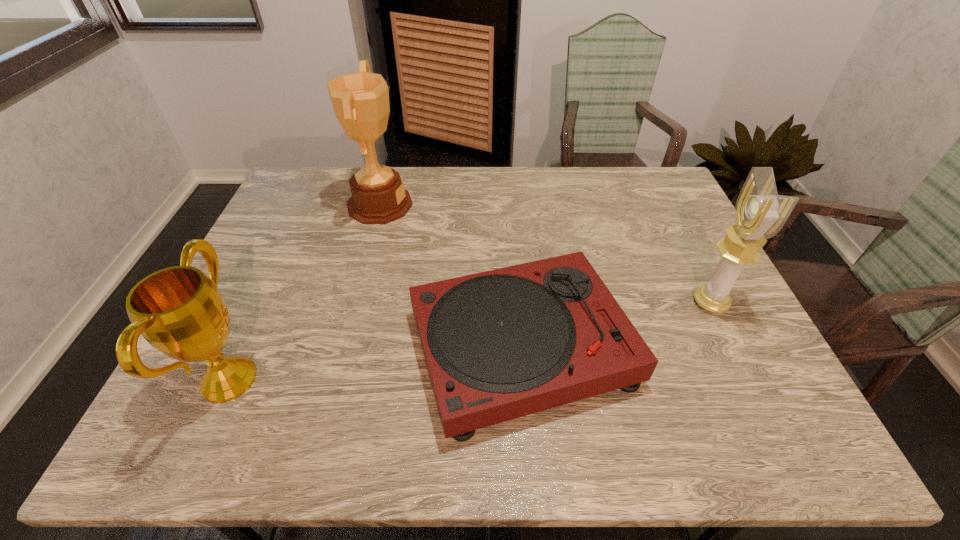
Find the location of `the farthest award`. the farthest award is located at coordinates (360, 100).

Where is `the second award from left to right`? This screenshot has height=540, width=960. the second award from left to right is located at coordinates coord(360,100).

This screenshot has height=540, width=960. What are the coordinates of `the rightmost award` in the screenshot? It's located at (760, 213).

The image size is (960, 540). In order to click on the second nearest award in this screenshot , I will do `click(760, 213)`.

Identify the location of the leftmost award. (179, 311).

You are a GUI agent. You are given a task and a screenshot of the screen. Output one action in this format:
    pyautogui.click(x=<x>, y=<y>)
    Task: Click on the third tallest object
    
    Given the screenshot: What is the action you would take?
    pyautogui.click(x=179, y=311)

The height and width of the screenshot is (540, 960). What are the coordinates of `record player` in the screenshot? It's located at (501, 344).

I want to click on the third object from left to right, so click(501, 344).

Where is `free space located 0.220m on the front-facing side of the second award from right to left`? This screenshot has width=960, height=540. free space located 0.220m on the front-facing side of the second award from right to left is located at coordinates (481, 205).

What are the coordinates of `vacant space located 0.210m on the front-facing side of the rightmost object` in the screenshot? It's located at (611, 303).